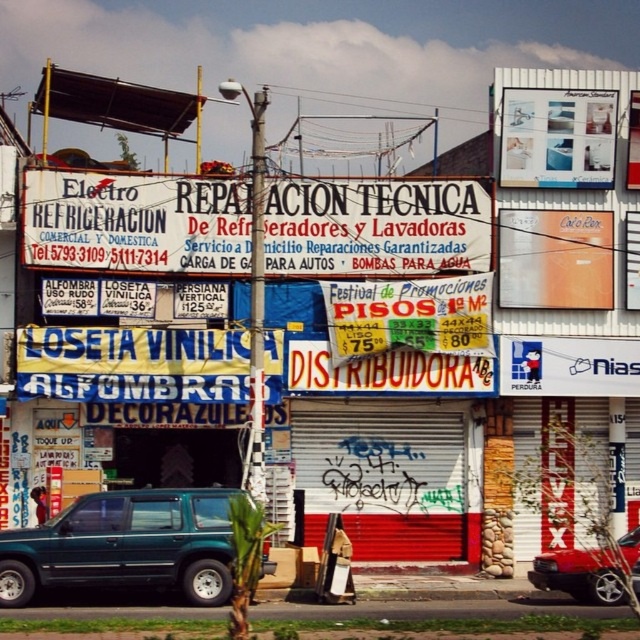
Question: Which point appears farthest from the camera in this image?

Choices:
 (A) (193, 560)
 (B) (625, 545)
 (C) (188, 241)

Answer: (C)

Question: Which is farther from the green matte suv at lower left?

Choices:
 (A) red glossy car at center
 (B) white paper sign at center

Answer: (B)

Question: Estimate the real-world distances between objects in this image. Which object is farther from the green matte suv at lower left?

Choices:
 (A) red glossy car at center
 (B) white paper sign at center

Answer: (B)

Question: Does green matte suv at lower left appear on the left side of red glossy car at center?

Choices:
 (A) no
 (B) yes

Answer: (B)

Question: Is white paper sign at center closer to the viewer compared to red glossy car at center?

Choices:
 (A) no
 (B) yes

Answer: (A)

Question: Is green matte suv at lower left further to the viewer compared to red glossy car at center?

Choices:
 (A) yes
 (B) no

Answer: (B)